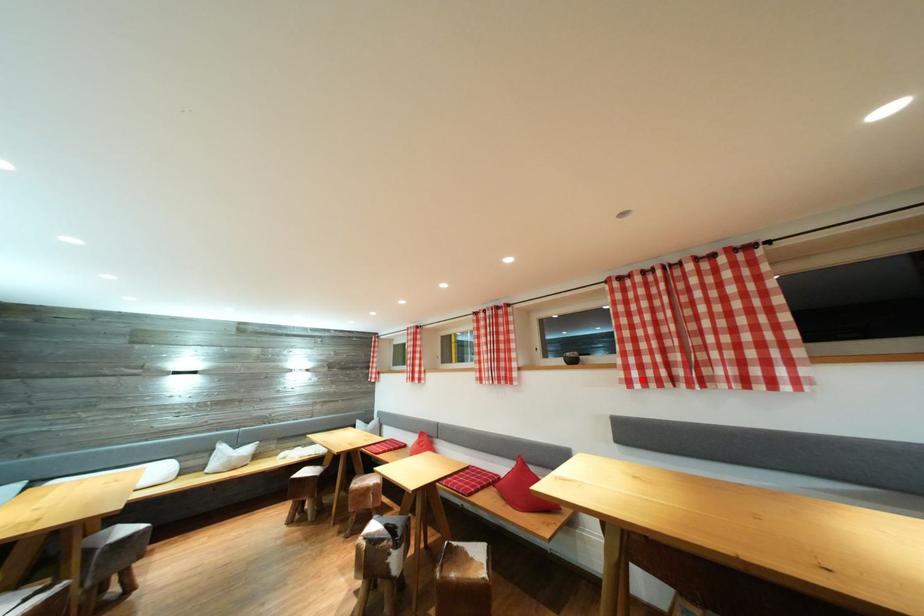
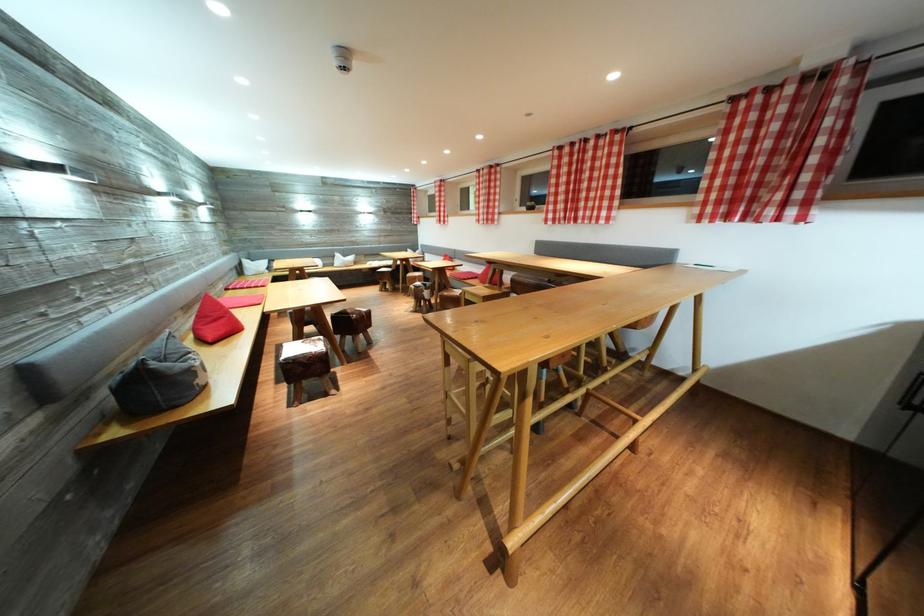
Question: I am providing you with two images of the same scene from different viewpoints. Given a red point in image1, look at the same physical point in image2. Is it:

Choices:
 (A) Closer to the viewpoint
 (B) Farther from the viewpoint

Answer: (A)